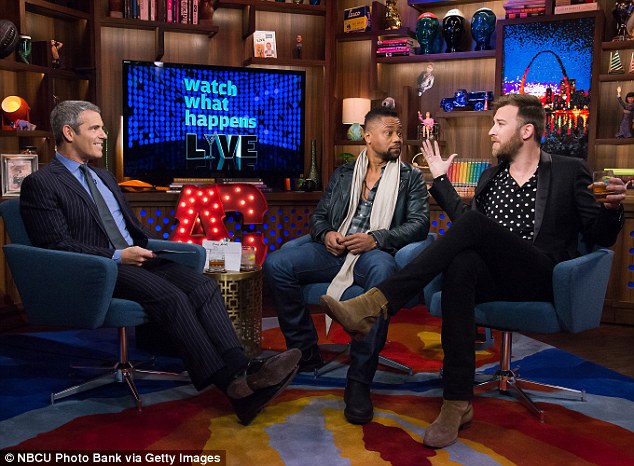
Where is `lampshade`? This screenshot has width=634, height=466. lampshade is located at coordinates (357, 111).